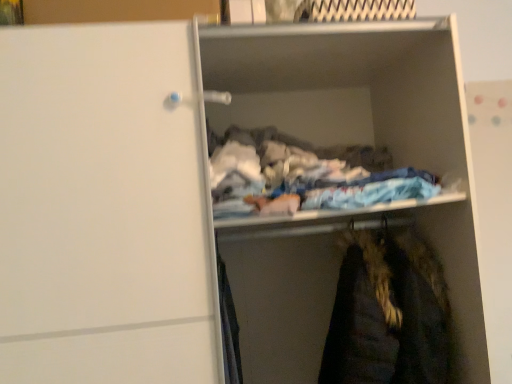
Measure the distance between point (357, 118) and camera.

Point (357, 118) is 5.53 feet away from camera.

This screenshot has height=384, width=512. Describe the element at coordinates (349, 90) in the screenshot. I see `white matte clothes at center` at that location.

Locate an element on the screen. Image resolution: width=512 pixels, height=384 pixels. white matte clothes at center is located at coordinates click(x=349, y=90).

You are a GUI agent. You are given a task and a screenshot of the screen. Output one action in this format:
    pyautogui.click(x=<x>, y=<y>)
    Task: Click on the velvet-like dark brown coat at lower right
    
    Given the screenshot: What is the action you would take?
    pyautogui.click(x=388, y=313)

What do you see at coordinates (388, 313) in the screenshot?
I see `velvet-like dark brown coat at lower right` at bounding box center [388, 313].

Locate an element on the screen. Image resolution: width=512 pixels, height=384 pixels. white matte clothes at center is located at coordinates (349, 90).

Which is more to the right, white matte clothes at center or velvet-like dark brown coat at lower right?

velvet-like dark brown coat at lower right.

Which object is closer to the camera, white matte clothes at center or velvet-like dark brown coat at lower right?

Positioned in front is white matte clothes at center.

Which is farther from the camera, (282, 79) or (349, 338)?

Point (282, 79)

From the image's perspective, is white matte clothes at center above or below velvet-like dark brown coat at lower right?

white matte clothes at center is situated higher than velvet-like dark brown coat at lower right in the image.

From a real-world perspective, is white matte clothes at center located higher than velvet-like dark brown coat at lower right?

Yes, from a real-world perspective, white matte clothes at center is above velvet-like dark brown coat at lower right.

Is white matte clothes at center thinner than velvet-like dark brown coat at lower right?

Yes, white matte clothes at center is thinner than velvet-like dark brown coat at lower right.

Which of these two, white matte clothes at center or velvet-like dark brown coat at lower right, stands taller?

With more height is velvet-like dark brown coat at lower right.

Considering the sizes of objects white matte clothes at center and velvet-like dark brown coat at lower right in the image provided, who is bigger, white matte clothes at center or velvet-like dark brown coat at lower right?

white matte clothes at center is bigger.

Can velvet-like dark brown coat at lower right be found inside white matte clothes at center?

That's incorrect, velvet-like dark brown coat at lower right is not inside white matte clothes at center.

Is white matte clothes at center positioned far away from velvet-like dark brown coat at lower right?

That's not correct — white matte clothes at center is a little close to velvet-like dark brown coat at lower right.

Is velvet-like dark brown coat at lower right at the back of white matte clothes at center?

No, white matte clothes at center's orientation is not away from velvet-like dark brown coat at lower right.

Can you tell me how much white matte clothes at center and velvet-like dark brown coat at lower right differ in facing direction?

0.00227 degrees.

You are a GUI agent. You are given a task and a screenshot of the screen. Output one action in this format:
    pyautogui.click(x=<x>, y=<y>)
    Task: Click on the cabinet above the velvet-like dark brown coat at lower right (from the image's perspective)
    The width and height of the screenshot is (512, 384).
    Given the screenshot: What is the action you would take?
    pyautogui.click(x=349, y=90)

Is velvet-like dark brown coat at lower right to the right of white matte clothes at center from the viewer's perspective?

Yes.

Is velvet-like dark brown coat at lower right positioned in front of white matte clothes at center?

No, it is behind white matte clothes at center.

Is point (362, 302) positioned after point (313, 122)?

No, (362, 302) is in front of (313, 122).

From the image's perspective, which object appears higher, velvet-like dark brown coat at lower right or white matte clothes at center?

white matte clothes at center is shown above in the image.

From a real-world perspective, is velvet-like dark brown coat at lower right on white matte clothes at center?

Actually, velvet-like dark brown coat at lower right is physically below white matte clothes at center in the real world.

Does velvet-like dark brown coat at lower right have a lesser width compared to white matte clothes at center?

In fact, velvet-like dark brown coat at lower right might be wider than white matte clothes at center.

Can you confirm if velvet-like dark brown coat at lower right is taller than white matte clothes at center?

Yes.

Considering the sizes of objects velvet-like dark brown coat at lower right and white matte clothes at center in the image provided, who is bigger, velvet-like dark brown coat at lower right or white matte clothes at center?

white matte clothes at center.

Choose the correct answer: Is velvet-like dark brown coat at lower right inside white matte clothes at center or outside it?

velvet-like dark brown coat at lower right is not enclosed by white matte clothes at center.

Is velvet-like dark brown coat at lower right in contact with white matte clothes at center?

velvet-like dark brown coat at lower right is not next to white matte clothes at center, and they're not touching.

Does velvet-like dark brown coat at lower right turn towards white matte clothes at center?

No, velvet-like dark brown coat at lower right is not facing towards white matte clothes at center.

Where is `cabinet that appears in front of the velvet-like dark brown coat at lower right`? cabinet that appears in front of the velvet-like dark brown coat at lower right is located at coordinates (349, 90).

You are a GUI agent. You are given a task and a screenshot of the screen. Output one action in this format:
    pyautogui.click(x=<x>, y=<y>)
    Task: Click on the cloak behind the white matte clothes at center
    
    Given the screenshot: What is the action you would take?
    pyautogui.click(x=388, y=313)

This screenshot has width=512, height=384. I want to click on cloak below the white matte clothes at center (from a real-world perspective), so click(388, 313).